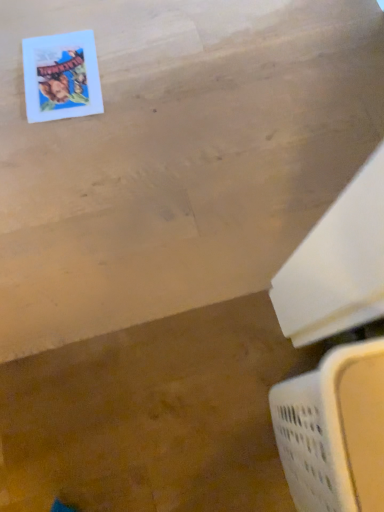
The height and width of the screenshot is (512, 384). Identify the location of vacant area on the back side of matte paper comic book at upper left. (76, 17).